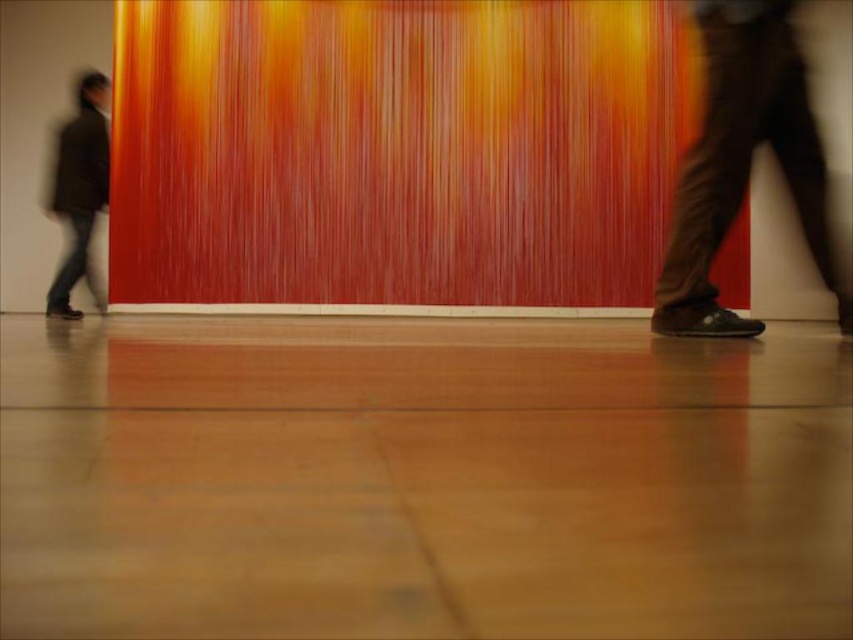
Can you confirm if brown leather shoes at right is positioned to the right of dark brown leather jacket at left?

Indeed, brown leather shoes at right is positioned on the right side of dark brown leather jacket at left.

Between point (811, 218) and point (56, 301), which one is positioned behind?

The point (56, 301) is more distant.

Between point (704, 262) and point (48, 310), which one is positioned in front?

Positioned in front is point (704, 262).

Find the location of `brown leather shoes at right`. brown leather shoes at right is located at coordinates (743, 163).